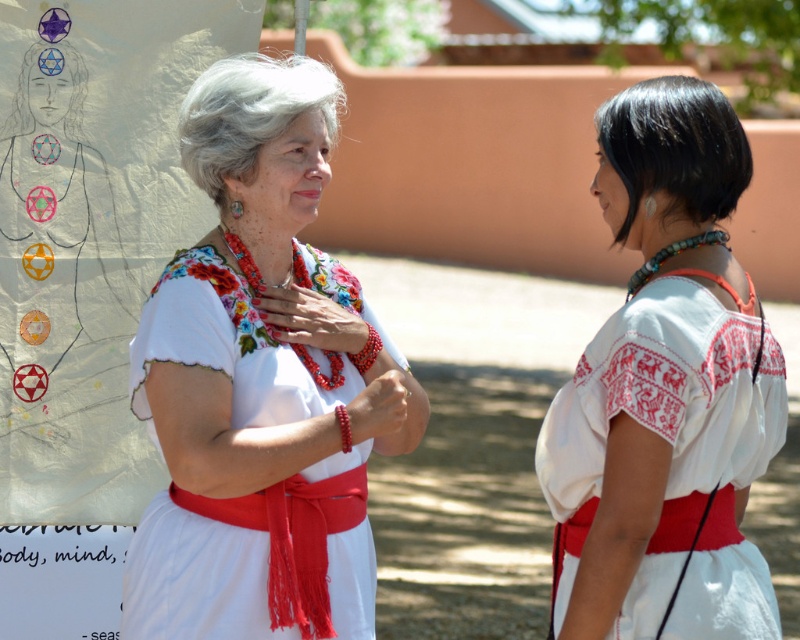
Question: Can you confirm if white embroidered blouse at center is positioned above white cotton dress at right?

Choices:
 (A) no
 (B) yes

Answer: (B)

Question: Can you confirm if white embroidered blouse at center is thinner than white cotton dress at right?

Choices:
 (A) no
 (B) yes

Answer: (A)

Question: Which of the following is the closest to the observer?

Choices:
 (A) white cotton dress at right
 (B) white embroidered blouse at center

Answer: (A)

Question: Is white embroidered blouse at center above white cotton dress at right?

Choices:
 (A) yes
 (B) no

Answer: (A)